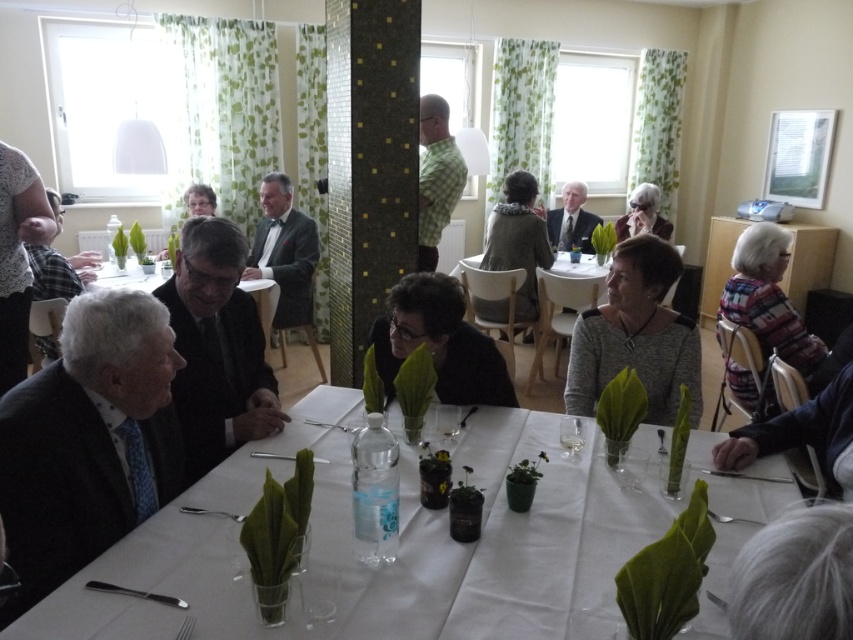
You are a guest at this gathering and want to place your phone between the plaid wool sweater at right and the clear glass wine glass at center. Can your phone fit in the space between them?

The plaid wool sweater at right is wider than the clear glass wine glass at center, so there might be enough space to place your phone between them. However, the exact fit depends on the phone size and the distance between the two objects.

You are a guest at this event and need to place your black suit at center on the table without it tipping over. Considering the clear glass wine glass at center is already there, which object should you be cautious about to avoid knocking over?

The black suit at center is taller than the clear glass wine glass at center, so you should be cautious of the clear glass wine glass at center as it might be knocked over more easily due to its smaller height and possibly narrower base.

You are standing at the edge of the table in the dining hall and see two points marked on the table surface. The first point is at coordinate point (201, 406) and the second is at point (757, 440). Which point is closer to you?

Point (201, 406) is closer to you because it is further to the camera than point (757, 440).